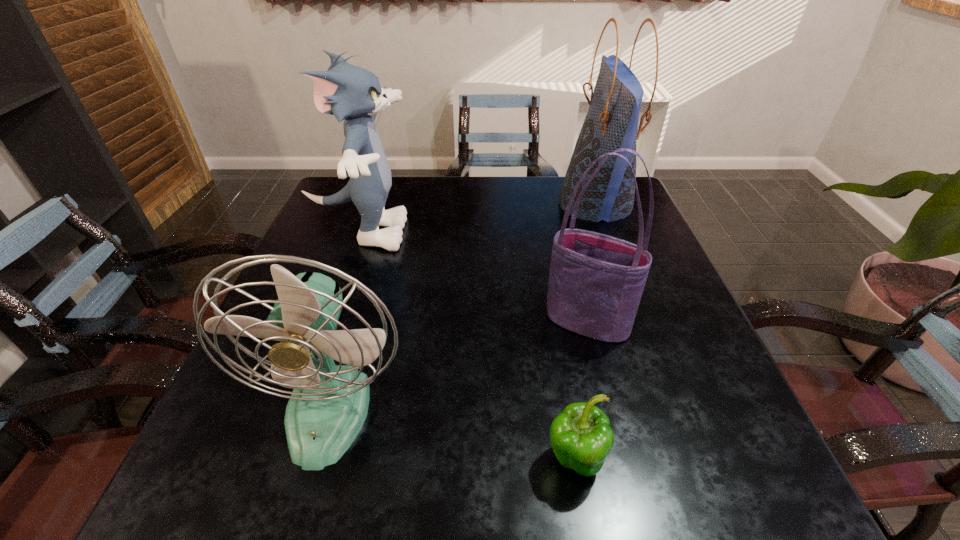
Find the location of a particular element. shopping bag situated at the far edge is located at coordinates (611, 123).

I want to click on cat located at the far edge, so click(x=348, y=92).

Where is `fan situated at the near edge`? This screenshot has width=960, height=540. fan situated at the near edge is located at coordinates (328, 406).

Find the location of a particular element. Image resolution: width=960 pixels, height=540 pixels. bell pepper at the near edge is located at coordinates (581, 437).

In order to click on cat that is at the left edge in this screenshot , I will do `click(348, 92)`.

The image size is (960, 540). Find the location of `fan positioned at the left edge`. fan positioned at the left edge is located at coordinates (328, 406).

This screenshot has height=540, width=960. In order to click on shopping bag at the right edge in this screenshot , I will do `click(611, 123)`.

This screenshot has height=540, width=960. I want to click on tote bag present at the right edge, so click(596, 281).

Locate an element on the screen. Image resolution: width=960 pixels, height=540 pixels. object at the far left corner is located at coordinates (348, 92).

This screenshot has width=960, height=540. Identify the location of object situated at the near left corner. (328, 406).